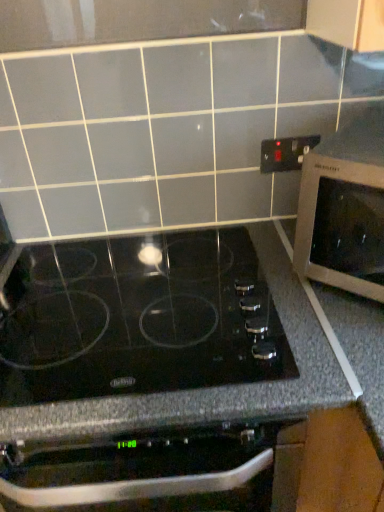
Question: Can you confirm if black plastic electrical outlet at upper right is shorter than black glass cooktop at center?

Choices:
 (A) no
 (B) yes

Answer: (B)

Question: Is black plastic electrical outlet at upper right located outside black glass cooktop at center?

Choices:
 (A) yes
 (B) no

Answer: (A)

Question: From a real-world perspective, is black plastic electrical outlet at upper right below black glass cooktop at center?

Choices:
 (A) no
 (B) yes

Answer: (A)

Question: Can you see black plastic electrical outlet at upper right touching black glass cooktop at center?

Choices:
 (A) no
 (B) yes

Answer: (A)

Question: Considering the relative positions of black plastic electrical outlet at upper right and black glass cooktop at center in the image provided, is black plastic electrical outlet at upper right to the right of black glass cooktop at center from the viewer's perspective?

Choices:
 (A) no
 (B) yes

Answer: (B)

Question: Can you confirm if black plastic electrical outlet at upper right is smaller than black glass cooktop at center?

Choices:
 (A) yes
 (B) no

Answer: (A)

Question: Considering the relative sizes of black glass cooktop at center and black plastic electrical outlet at upper right in the image provided, is black glass cooktop at center smaller than black plastic electrical outlet at upper right?

Choices:
 (A) yes
 (B) no

Answer: (B)

Question: Considering the relative positions of black glass cooktop at center and black plastic electrical outlet at upper right in the image provided, is black glass cooktop at center to the left of black plastic electrical outlet at upper right from the viewer's perspective?

Choices:
 (A) yes
 (B) no

Answer: (A)

Question: Is black glass cooktop at center positioned before black plastic electrical outlet at upper right?

Choices:
 (A) yes
 (B) no

Answer: (A)

Question: Would you say black plastic electrical outlet at upper right is part of black glass cooktop at center's contents?

Choices:
 (A) yes
 (B) no

Answer: (B)

Question: Can you confirm if black glass cooktop at center is positioned to the right of black plastic electrical outlet at upper right?

Choices:
 (A) no
 (B) yes

Answer: (A)

Question: Is black glass cooktop at center turned away from black plastic electrical outlet at upper right?

Choices:
 (A) yes
 (B) no

Answer: (B)

Question: Is silver metallic microwave at right closer to camera compared to black plastic electrical outlet at upper right?

Choices:
 (A) no
 (B) yes

Answer: (B)